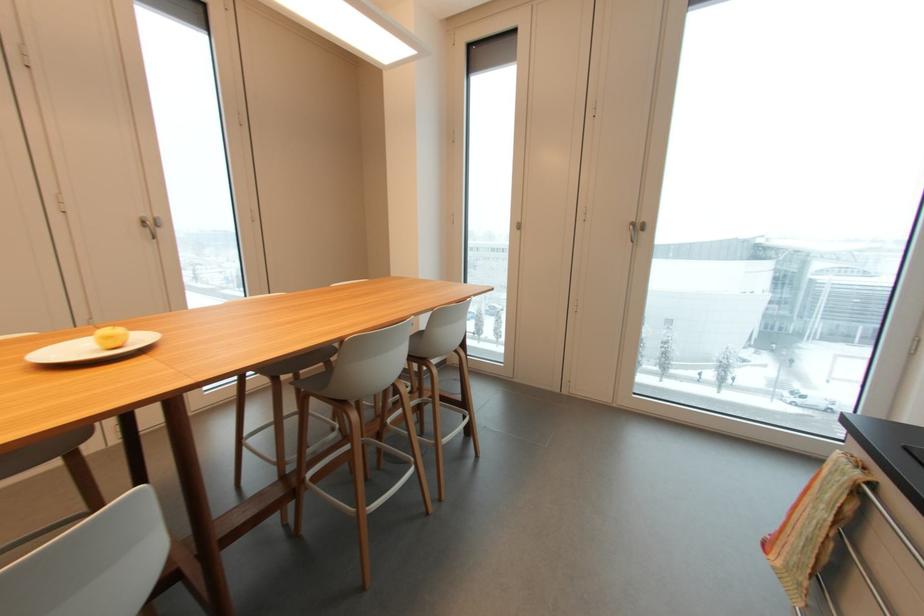
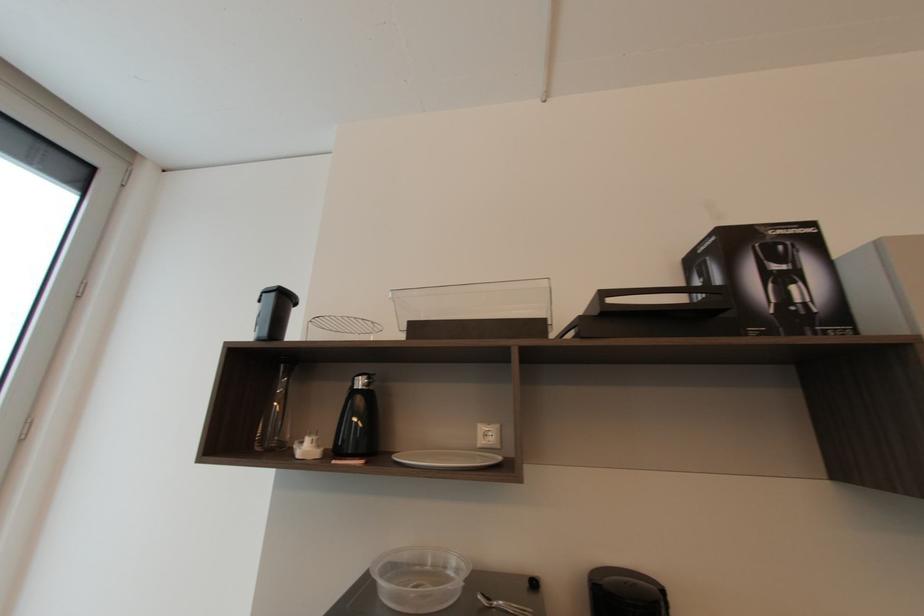
Question: The images are taken continuously from a first-person perspective. In which direction is your viewpoint rotating?

Choices:
 (A) Left
 (B) Right
 (C) Up
 (D) Down

Answer: (B)